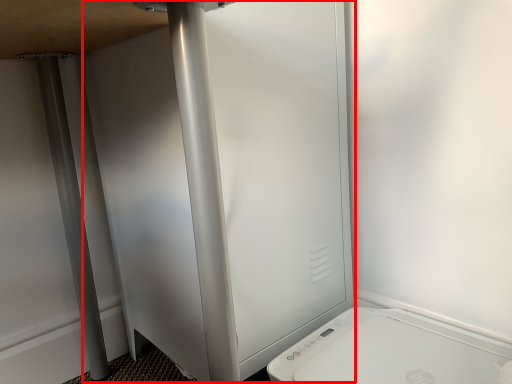
Question: From the image's perspective, considering the relative positions of screen door (annotated by the red box) and home appliance in the image provided, where is screen door (annotated by the red box) located with respect to the staircase?

Choices:
 (A) below
 (B) above

Answer: (B)